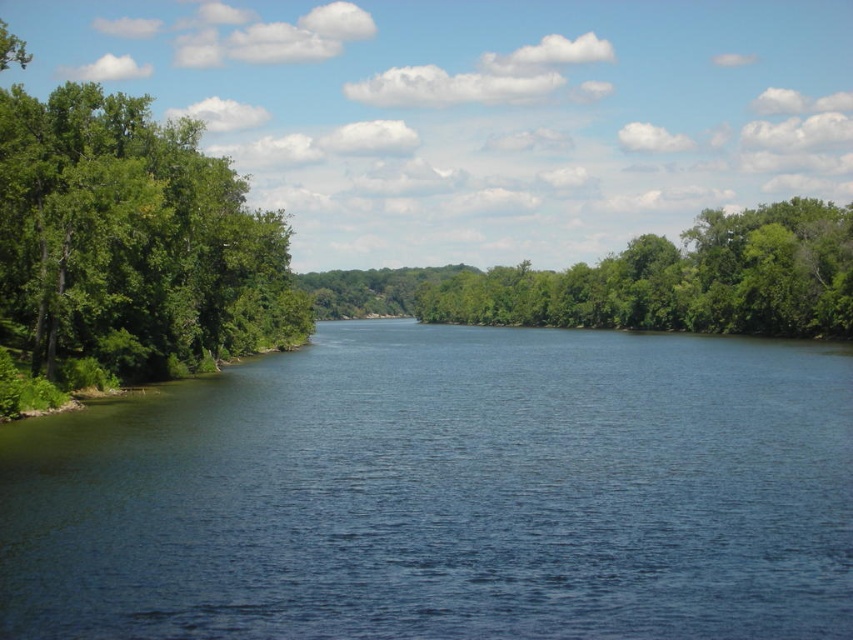
You are a bird flying over the river scene. You notice the blue water at center and the green leafy trees at left. Which one appears taller from your perspective?

The green leafy trees at left are taller than the blue water at center from your perspective.

You are standing on the riverbank and see the green leafy trees at left and the green leafy tree at center. Which group of trees is positioned more to the east side of the river?

The green leafy trees at left are positioned to the left of the green leafy tree at center, so they are more to the east side of the river.